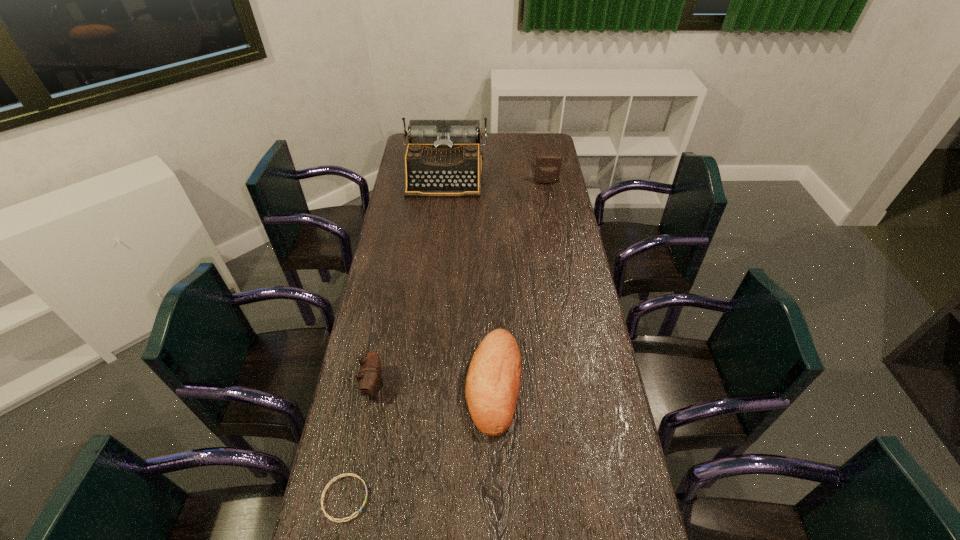
The height and width of the screenshot is (540, 960). What are the coordinates of `free space at the left edge of the desktop` in the screenshot? It's located at (351, 416).

This screenshot has height=540, width=960. In the image, there is a desktop. Identify the location of vacant space at the right edge. 592,350.

Find the location of a particular element. vacant region between the right pouch and the left pouch is located at coordinates (460, 284).

This screenshot has height=540, width=960. Identify the location of vacant point located between the tallest object and the nearest object. (395, 336).

Locate an element on the screen. The height and width of the screenshot is (540, 960). free spot between the second shortest object and the tallest object is located at coordinates (469, 279).

The image size is (960, 540). Identify the location of free space between the nearest object and the second shortest object. (420, 441).

Locate an element on the screen. free area in between the nearest object and the left pouch is located at coordinates (359, 442).

Identify the location of vacant space in between the farther pouch and the bread. (520, 283).

You are a GUI agent. You are given a task and a screenshot of the screen. Output one action in this format:
    pyautogui.click(x=<x>, y=<y>)
    Task: Click on the free spot between the tallest object and the bread
    
    Given the screenshot: What is the action you would take?
    pyautogui.click(x=469, y=279)

The height and width of the screenshot is (540, 960). I want to click on free area in between the shorter pouch and the fourth tallest object, so click(x=434, y=384).